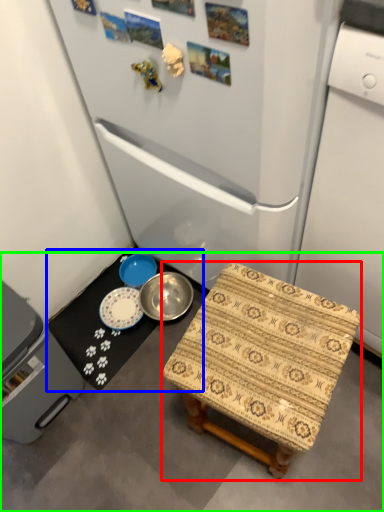
Question: Based on their relative distances, which object is farther from furniture (highlighted by a red box)? Choose from table (highlighted by a blue box) and concrete (highlighted by a green box).

Choices:
 (A) table
 (B) concrete

Answer: (A)